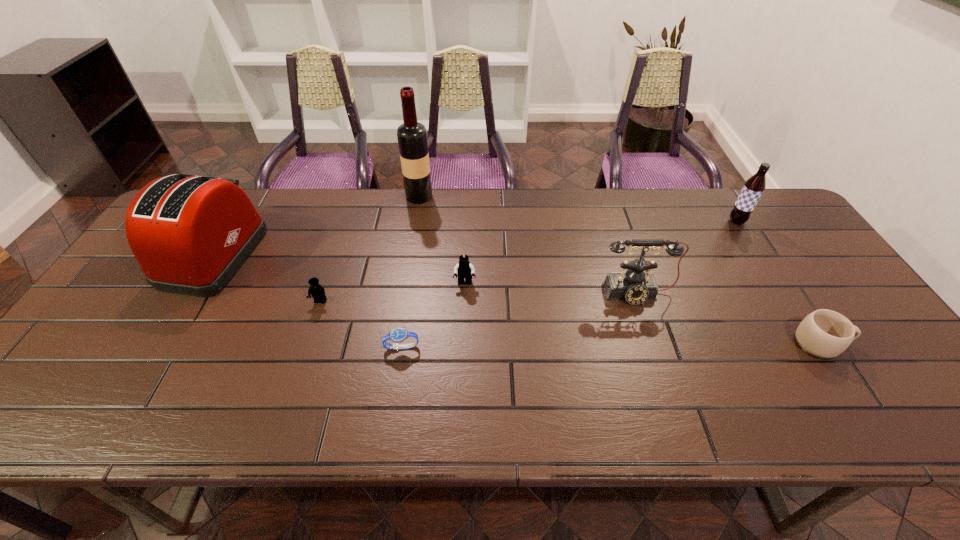
Find the location of a particular element. This screenshot has height=540, width=960. the shortest object is located at coordinates (398, 335).

In order to click on free space located on the left of the tallest object in this screenshot , I will do `click(346, 196)`.

Locate an element on the screen. The image size is (960, 540). vacant region located 0.290m on the right of the toaster is located at coordinates (356, 255).

Where is `free space located on the left of the root beer`? This screenshot has width=960, height=540. free space located on the left of the root beer is located at coordinates [x=692, y=221].

Identify the location of vacant area located on the dial of the third object from right to left. coord(675,411).

I want to click on free space located on the front-facing side of the taller Lego, so click(464, 308).

The height and width of the screenshot is (540, 960). What are the coordinates of `vacant space located on the front-facing side of the shorter Lego` in the screenshot? It's located at tap(287, 402).

Where is `free space located on the side of the mug with the handle`? This screenshot has width=960, height=540. free space located on the side of the mug with the handle is located at coordinates (881, 344).

This screenshot has height=540, width=960. I want to click on vacant space located on the right of the shortest object, so (x=466, y=347).

Find the location of a particular element. The height and width of the screenshot is (540, 960). wine bottle at the far edge is located at coordinates (412, 136).